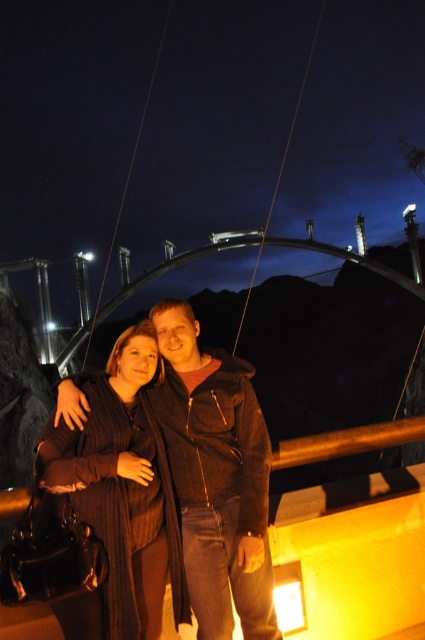
Question: Does dark brown jacket at center come behind knitted sweater at center?

Choices:
 (A) no
 (B) yes

Answer: (B)

Question: Which of the following is the farthest from the observer?

Choices:
 (A) dark brown jacket at center
 (B) knitted sweater at center

Answer: (A)

Question: Can you confirm if dark brown jacket at center is positioned to the right of knitted sweater at center?

Choices:
 (A) yes
 (B) no

Answer: (A)

Question: Is dark brown jacket at center bigger than knitted sweater at center?

Choices:
 (A) no
 (B) yes

Answer: (B)